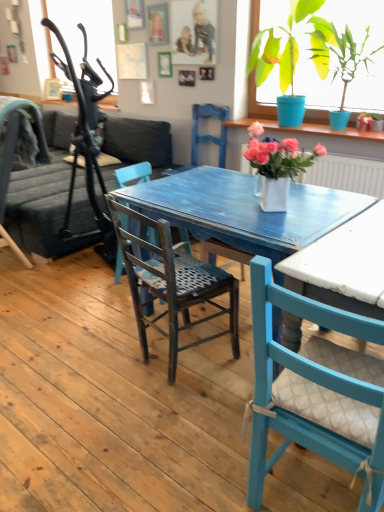
Question: Considering the relative positions of dark gray fabric couch at left and white ceramic vase at center, which ranks as the 2th houseplant in top-to-bottom order, in the image provided, is dark gray fabric couch at left to the left or to the right of white ceramic vase at center, which ranks as the 2th houseplant in top-to-bottom order,?

Choices:
 (A) left
 (B) right

Answer: (A)

Question: Is point (46, 241) closer or farther from the camera than point (322, 146)?

Choices:
 (A) closer
 (B) farther

Answer: (A)

Question: Estimate the real-world distances between objects in this image. Which object is farther from the green glossy plant at upper right, positioned as the first houseplant in right-to-left order?

Choices:
 (A) blue wooden chair at center
 (B) white ceramic vase at center, which ranks as the 2th houseplant in top-to-bottom order
 (C) dark blue fabric chair at left, which ranks as the first chair in left-to-right order
 (D) wooden chair with patterned seat cushion at center, which appears as the 2th chair when viewed from the front
 (E) matte blue chair with cushion at center, placed as the 3th chair when sorted from left to right

Answer: (E)

Question: Estimate the real-world distances between objects in this image. Which object is closer to the dark blue fabric chair at left, the first chair positioned from the back?

Choices:
 (A) matte blue chair with cushion at center, which is the first chair from front to back
 (B) dark gray fabric couch at left
 (C) green glossy plant at upper right, positioned as the 2th houseplant in front-to-back order
 (D) white ceramic vase at center, the first houseplant when ordered from bottom to top
 (E) wooden chair with patterned seat cushion at center, which is counted as the 2th chair, starting from the right

Answer: (B)